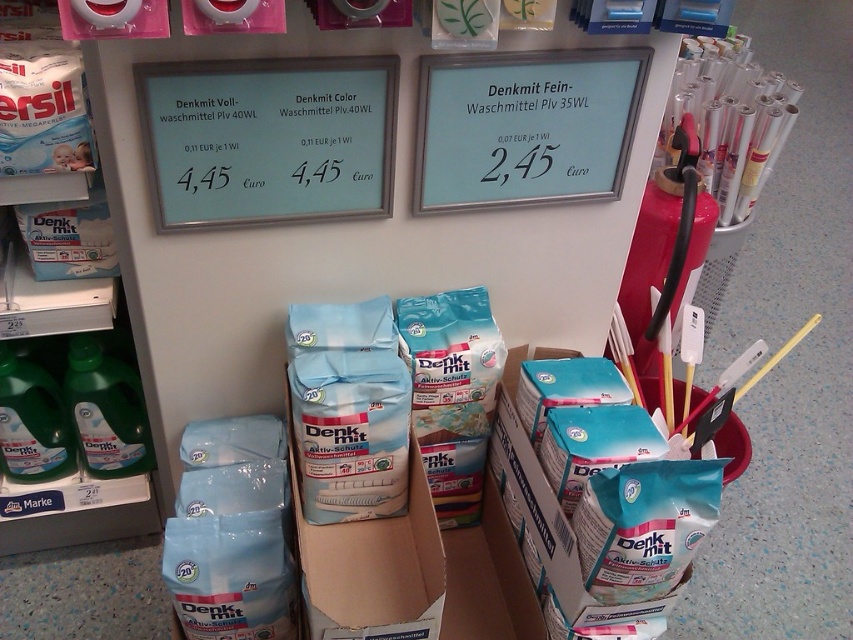
Question: Which point appears closest to the camera in this image?

Choices:
 (A) [x=33, y=515]
 (B) [x=664, y=152]
 (C) [x=4, y=376]

Answer: (C)

Question: Which object is positioned closest to the translucent green bottle at left?

Choices:
 (A) green plastic bottles at left
 (B) green plastic bottle at lower left

Answer: (B)

Question: Does white plastic straws at upper right appear under translucent green bottle at left?

Choices:
 (A) yes
 (B) no

Answer: (B)

Question: From the image, what is the correct spatial relationship of white plastic sign at upper center in relation to green plastic bottles at left?

Choices:
 (A) below
 (B) above

Answer: (B)

Question: Which point appears farthest from the camera in this image?

Choices:
 (A) (448, 77)
 (B) (350, 145)
 (C) (776, 156)

Answer: (C)

Question: Is green plastic bottles at left to the right of translucent green bottle at left from the viewer's perspective?

Choices:
 (A) no
 (B) yes

Answer: (A)